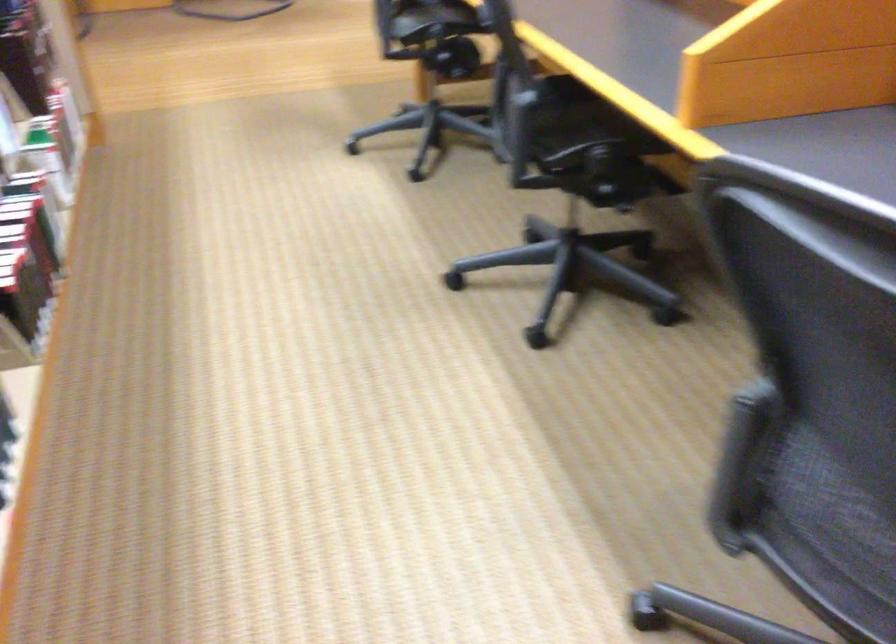
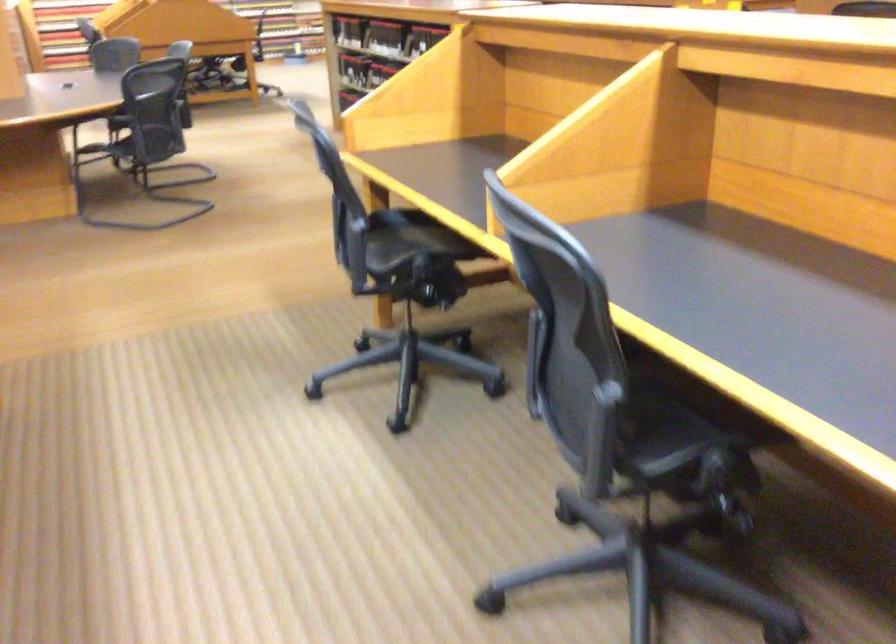
Where in the second image is the point corresponding to point 619,125 from the first image?

(699, 399)